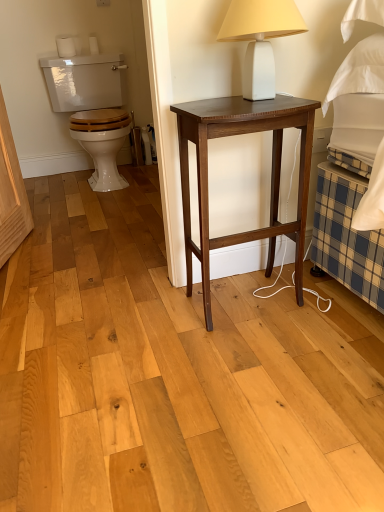
Image resolution: width=384 pixels, height=512 pixels. I want to click on vacant region under dark wood nightstand at center (from a real-world perspective), so click(252, 297).